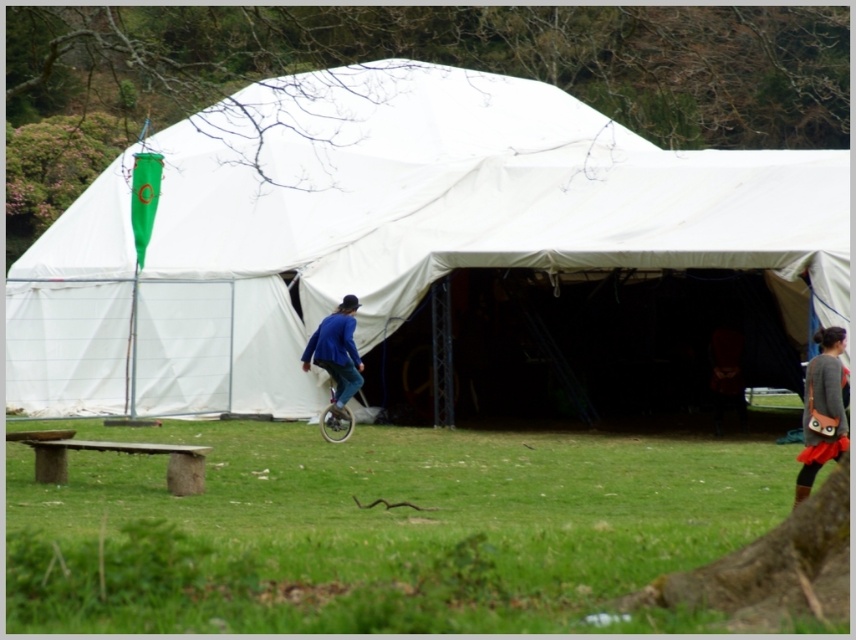
You are planning to set up a small picnic blanket in the area where the metallic silver unicycle at center is currently located. Based on the scene description, will the green grass at lower center interfere with placing the blanket there?

The green grass at lower center is in front of the metallic silver unicycle at center, meaning the grass is closer to the front of the unicycle. Since the unicycle is at the center, the grass in front of it would be a suitable spot for placing the picnic blanket as it is part of the grassy area. However, you would need to move the unicycle temporarily to access that spot.

You are standing at the entrance of the large white tent and see the green grass at lower center and the metallic silver unicycle at center. Which object is located to the right of the other?

The green grass at lower center is to the right of the metallic silver unicycle at center.

You are standing in front of the white fabric tent at center and want to walk to the gray fabric skirt at right. Which direction should you move relative to the tent?

You should move to the right relative to the white fabric tent at center because the gray fabric skirt at right is located to its right side.